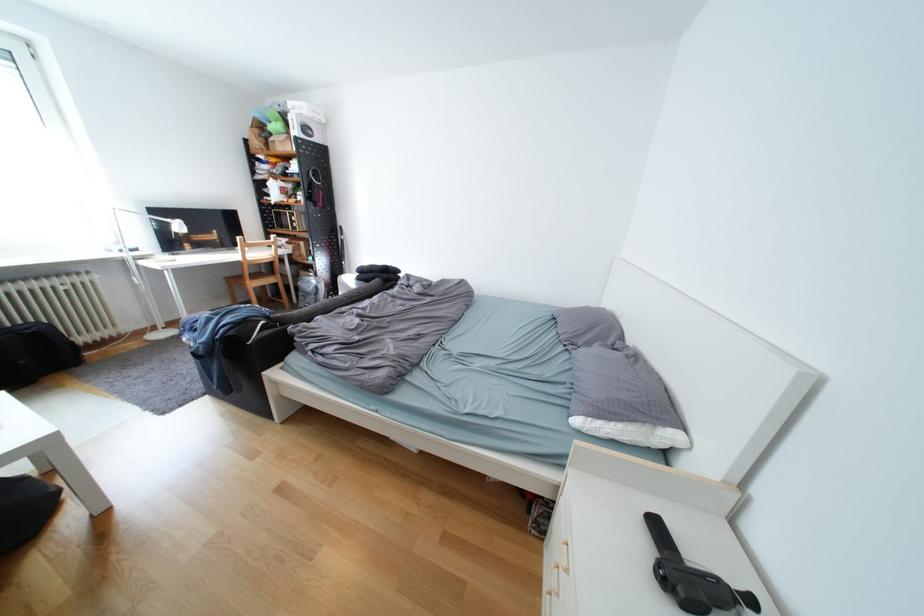
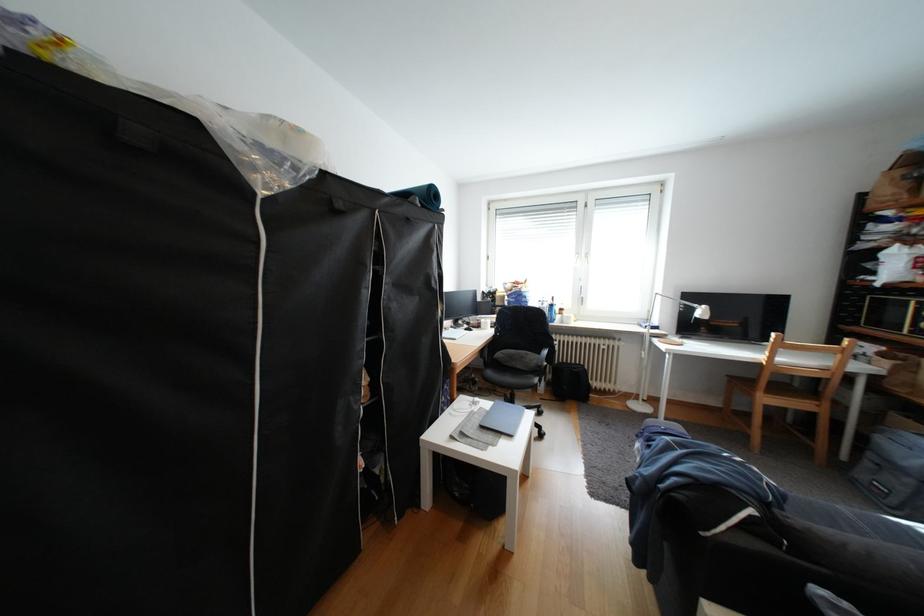
Locate, in the second image, the point that corresponds to point 223,321 in the first image.

(682, 448)